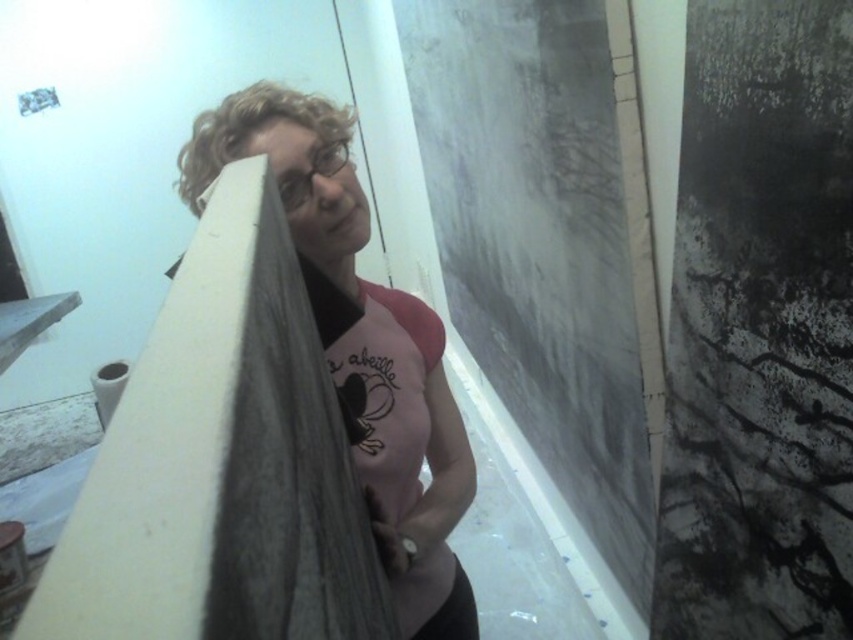
Is the position of matte gray fabric at center less distant than that of curly blonde hair at upper left?

That is False.

Who is lower down, matte gray fabric at center or curly blonde hair at upper left?

Positioned lower is matte gray fabric at center.

Which is in front, point (195, 164) or point (245, 140)?

Point (245, 140)

I want to click on matte gray fabric at center, so click(361, 344).